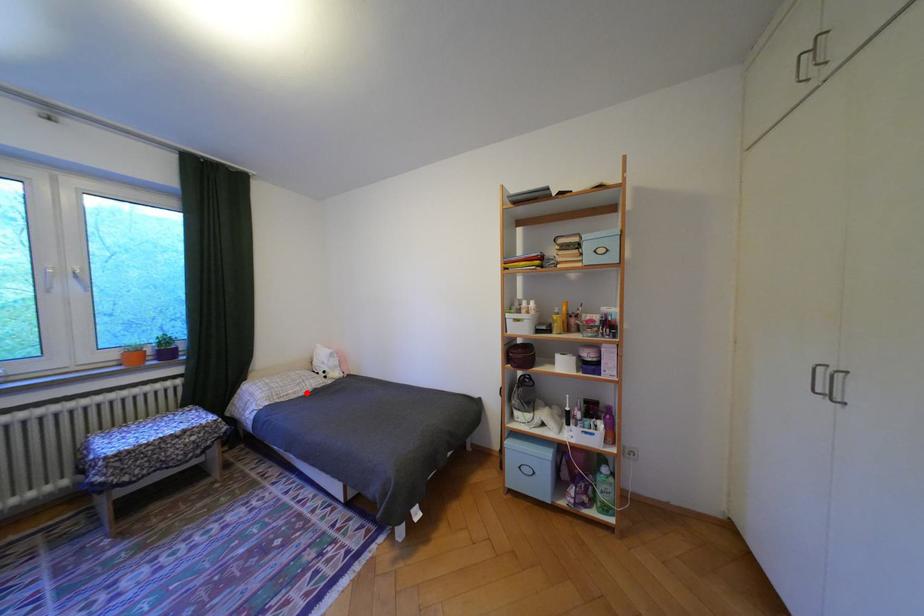
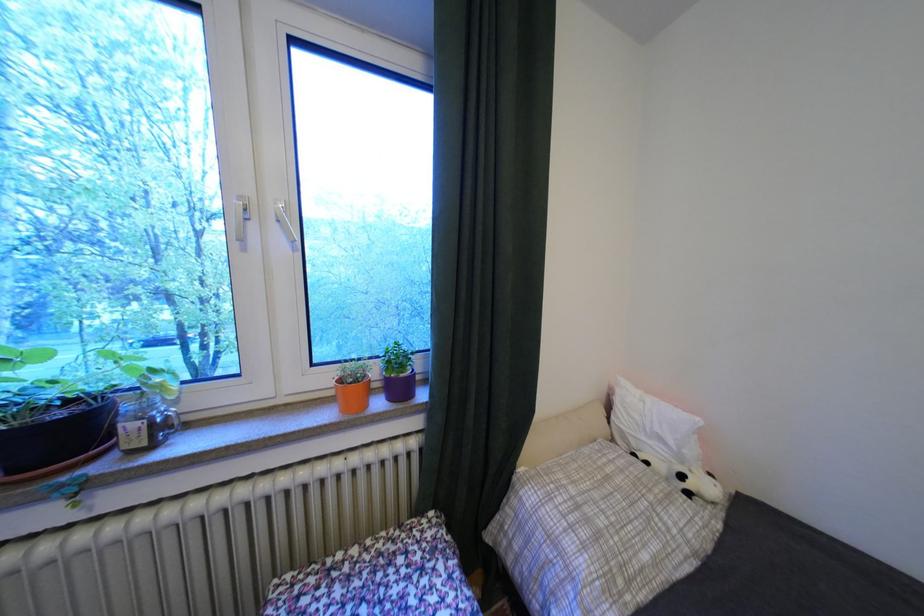
Locate, in the second image, the point that corresponds to the highlighted location in the first image.

(667, 562)